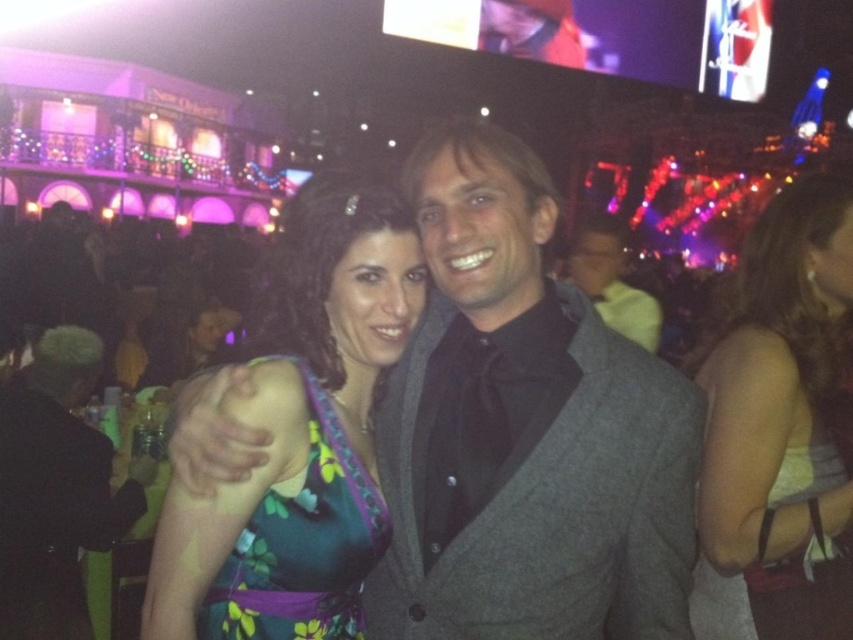
Who is more distant from viewer, (361, 525) or (601, 248)?

The point (601, 248) is behind.

Does floral dress at center have a lesser height compared to gray wool suit at center?

Incorrect, floral dress at center's height does not fall short of gray wool suit at center's.

Who is more forward, (358, 291) or (648, 339)?

Positioned in front is point (358, 291).

The width and height of the screenshot is (853, 640). What are the coordinates of `floral dress at center` in the screenshot? It's located at (300, 435).

Can you confirm if light brown fabric dress at right is bigger than black satin suit at center?

Actually, light brown fabric dress at right might be smaller than black satin suit at center.

Is the position of light brown fabric dress at right less distant than that of black satin suit at center?

That is False.

Is point (761, 237) closer to camera compared to point (86, 612)?

No, it is behind (86, 612).

Locate an element on the screen. The image size is (853, 640). light brown fabric dress at right is located at coordinates (779, 429).

Looking at this image, can you confirm if black satin suit at center is thinner than green floral dress at center?

In fact, black satin suit at center might be wider than green floral dress at center.

Which is more to the left, black satin suit at center or green floral dress at center?

Positioned to the left is black satin suit at center.

Between point (54, 356) and point (308, 624), which one is positioned behind?

Point (54, 356)

I want to click on black satin suit at center, so click(x=56, y=490).